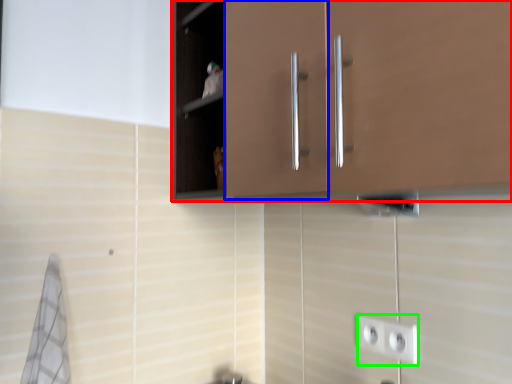
Question: Which is farther away from cabinetry (highlighted by a red box)? cabinetry (highlighted by a blue box) or socket (highlighted by a green box)?

Choices:
 (A) cabinetry
 (B) socket

Answer: (B)